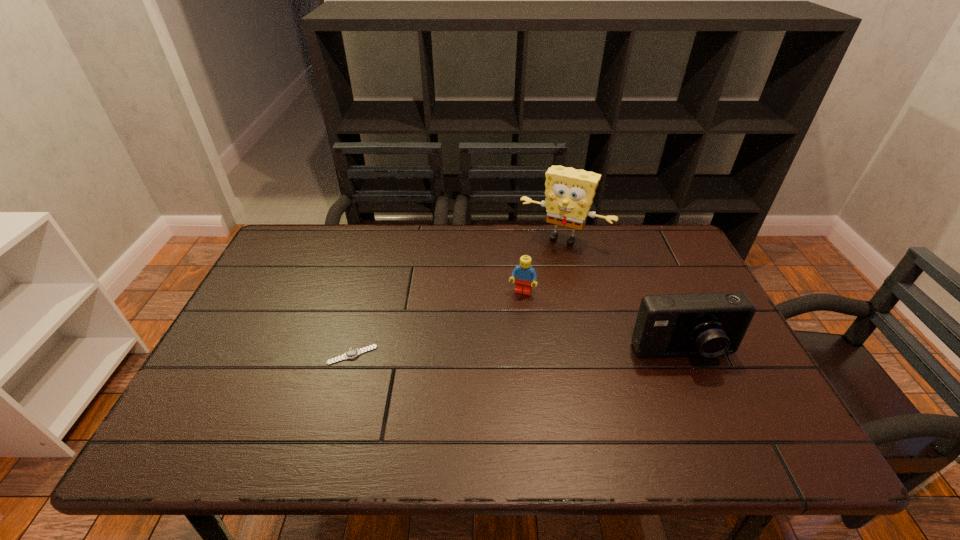
Image resolution: width=960 pixels, height=540 pixels. Find the location of `vacant area situated 0.310m on the face of the third tallest object`. vacant area situated 0.310m on the face of the third tallest object is located at coordinates (490, 386).

The image size is (960, 540). What are the coordinates of `vacant space located 0.290m on the face of the tallest object` in the screenshot? It's located at (517, 309).

I want to click on free point located on the face of the tallest object, so click(x=534, y=279).

Identify the location of vacant space positioned 0.400m on the face of the tallest object. The height and width of the screenshot is (540, 960). (504, 336).

At what (x,y) coordinates should I click in order to perform the action: click on object that is positioned at the far edge. Please return your answer as a coordinate pair (x, y). This screenshot has height=540, width=960. Looking at the image, I should click on (569, 193).

Identify the location of object present at the right edge. (709, 324).

Find the location of `free space at the far edge of the desktop`. free space at the far edge of the desktop is located at coordinates (545, 249).

At what (x,y) coordinates should I click in order to perform the action: click on free space at the near edge of the desktop. Please return your answer as a coordinate pair (x, y). Looking at the image, I should click on click(x=340, y=389).

The image size is (960, 540). In the image, there is a desktop. Find the location of `free space at the left edge`. free space at the left edge is located at coordinates (266, 288).

The image size is (960, 540). In order to click on free space at the far left corner of the desktop in this screenshot , I will do `click(284, 255)`.